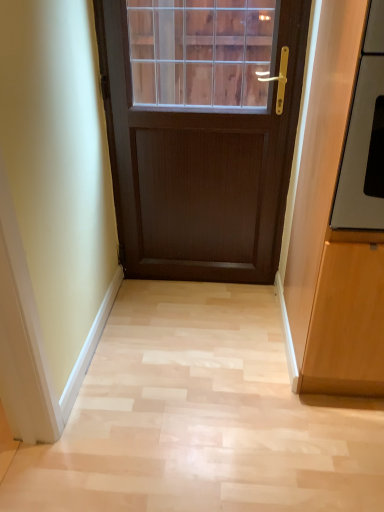
Locate an element on the screen. satin silver oven at right is located at coordinates (364, 138).

Identify the location of matte wood cabinet at right. The image size is (384, 512). (343, 224).

You are a GUI agent. You are given a task and a screenshot of the screen. Output one action in this format:
    pyautogui.click(x=<x>, y=<y>)
    Task: Click on the light wood floor at center
    
    Given the screenshot: What is the action you would take?
    coord(201,417)

Could you tell me if satin silver oven at right is facing light wood floor at center?

No.

What's the angular difference between satin silver oven at right and light wood floor at center's facing directions?

There is a 89.9-degree angle between the facing directions of satin silver oven at right and light wood floor at center.

In the scene shown: Which of these two, satin silver oven at right or light wood floor at center, is thinner?

With smaller width is satin silver oven at right.

In the image, there is a satin silver oven at right. In order to click on corridor below it (from a real-world perspective) in this screenshot , I will do (201, 417).

Relative to light wood floor at center, is matte wood cabinet at right in front or behind?

matte wood cabinet at right is positioned closer to the viewer than light wood floor at center.

Is matte wood cabinet at right not near light wood floor at center?

No, there isn't a large distance between matte wood cabinet at right and light wood floor at center.

Considering the sizes of objects matte wood cabinet at right and light wood floor at center in the image provided, who is wider, matte wood cabinet at right or light wood floor at center?

light wood floor at center.

Is light wood floor at center situated inside satin silver oven at right or outside?

The correct answer is: outside.

Is light wood floor at center touching satin silver oven at right?

No, light wood floor at center is not in contact with satin silver oven at right.

Who is shorter, light wood floor at center or satin silver oven at right?

light wood floor at center is shorter.

From a real-world perspective, is light wood floor at center physically located above or below satin silver oven at right?

light wood floor at center is below satin silver oven at right.

Considering the positions of points (366, 362) and (376, 191), is point (366, 362) closer to camera compared to point (376, 191)?

No, it is behind (376, 191).

Are matte wood cabinet at right and satin silver oven at right making contact?

No, matte wood cabinet at right is not in contact with satin silver oven at right.

Considering the relative sizes of matte wood cabinet at right and satin silver oven at right in the image provided, is matte wood cabinet at right wider than satin silver oven at right?

No, matte wood cabinet at right is not wider than satin silver oven at right.

From a real-world perspective, who is located lower, matte wood cabinet at right or satin silver oven at right?

From a 3D spatial view, matte wood cabinet at right is below.

Looking at this image, does light wood floor at center turn towards matte wood cabinet at right?

No, light wood floor at center is not turned towards matte wood cabinet at right.

From the image's perspective, which one is positioned lower, light wood floor at center or matte wood cabinet at right?

light wood floor at center.

In the image, there is a matte wood cabinet at right. Where is `corridor below it (from the image's perspective)`? corridor below it (from the image's perspective) is located at coordinates (201, 417).

Between light wood floor at center and matte wood cabinet at right, which one appears on the right side from the viewer's perspective?

matte wood cabinet at right is more to the right.

How different are the orientations of satin silver oven at right and matte wood cabinet at right in degrees?

180 degrees.

Looking at this image, which is closer, [348,181] or [360,154]?

The point [360,154] is closer.

Looking at this image, considering the positions of objects satin silver oven at right and matte wood cabinet at right in the image provided, who is in front, satin silver oven at right or matte wood cabinet at right?

Positioned in front is matte wood cabinet at right.

Based on the photo, between satin silver oven at right and matte wood cabinet at right, which one has more height?

Standing taller between the two is matte wood cabinet at right.

Where is `corridor below the satin silver oven at right (from a real-world perspective)`? The height and width of the screenshot is (512, 384). corridor below the satin silver oven at right (from a real-world perspective) is located at coordinates (201, 417).

The height and width of the screenshot is (512, 384). I want to click on corridor on the left side of matte wood cabinet at right, so click(x=201, y=417).

From the image, which object appears to be farther from satin silver oven at right, matte wood cabinet at right or light wood floor at center?

The object further to satin silver oven at right is light wood floor at center.

Looking at the image, which one is located further to satin silver oven at right, light wood floor at center or matte wood cabinet at right?

light wood floor at center is positioned further to the anchor satin silver oven at right.

From the image, which object appears to be farther from light wood floor at center, matte wood cabinet at right or satin silver oven at right?

Among the two, satin silver oven at right is located further to light wood floor at center.

Looking at the image, which one is located closer to matte wood cabinet at right, satin silver oven at right or light wood floor at center?

The object closer to matte wood cabinet at right is satin silver oven at right.

Looking at this image, which object lies further to the anchor point light wood floor at center, satin silver oven at right or matte wood cabinet at right?

Based on the image, satin silver oven at right appears to be further to light wood floor at center.

Considering their positions, is light wood floor at center positioned closer to matte wood cabinet at right than satin silver oven at right?

satin silver oven at right lies closer to matte wood cabinet at right than the other object.

At what (x,y) coordinates should I click in order to perform the action: click on cabinetry between satin silver oven at right and light wood floor at center in the up-down direction. Please return your answer as a coordinate pair (x, y). Image resolution: width=384 pixels, height=512 pixels. Looking at the image, I should click on (343, 224).